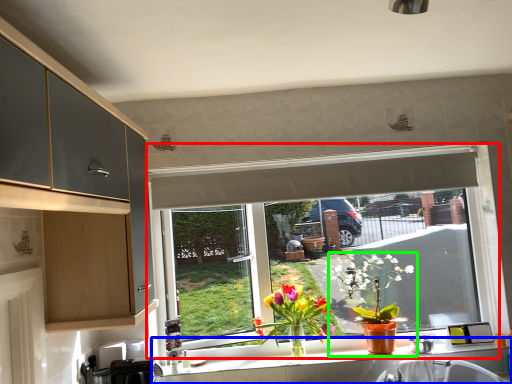
Question: Which object is positioned farthest from window (highlighted by a red box)? Select from countertop (highlighted by a blue box) and houseplant (highlighted by a green box).

Choices:
 (A) countertop
 (B) houseplant

Answer: (B)